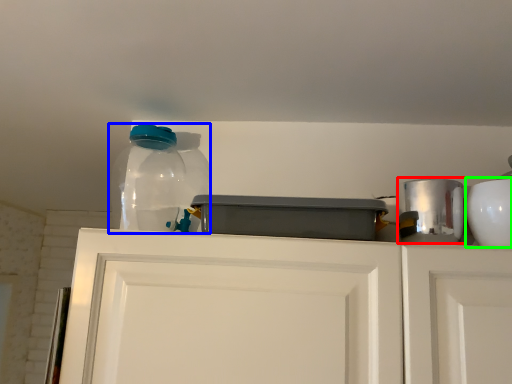
Question: Based on their relative distances, which object is nearer to appliance (highlighted by a red box)? Choose from bottle (highlighted by a blue box) and appliance (highlighted by a green box).

Choices:
 (A) bottle
 (B) appliance

Answer: (B)